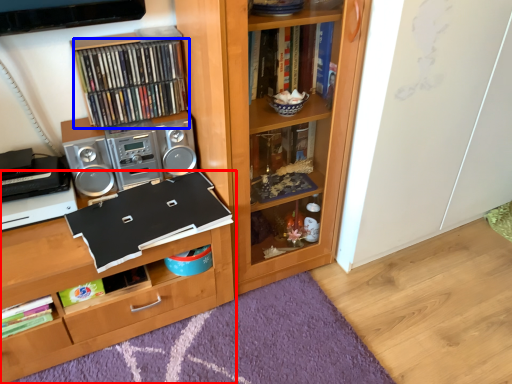
Question: Which object is further to the camera taking this photo, shelf (highlighted by a red box) or book (highlighted by a blue box)?

Choices:
 (A) shelf
 (B) book

Answer: (B)